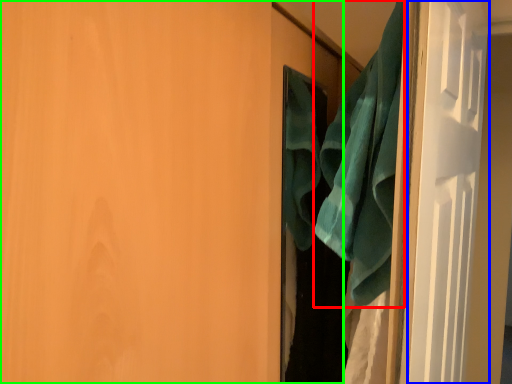
Question: Considering the real-world distances, which object is closest to beach towel (highlighted by a red box)? screen door (highlighted by a blue box) or door (highlighted by a green box).

Choices:
 (A) screen door
 (B) door

Answer: (A)